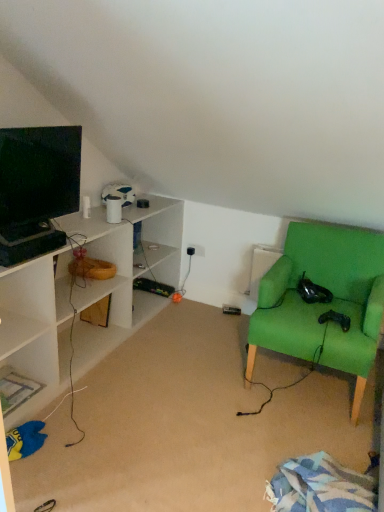
Question: Is there a large distance between matte black monitor at left and black plastic electric outlet at center?

Choices:
 (A) no
 (B) yes

Answer: (B)

Question: From the image's perspective, is matte black monitor at left over black plastic electric outlet at center?

Choices:
 (A) yes
 (B) no

Answer: (A)

Question: Does matte black monitor at left have a greater width compared to black plastic electric outlet at center?

Choices:
 (A) yes
 (B) no

Answer: (A)

Question: Considering the relative positions of matte black monitor at left and black plastic electric outlet at center in the image provided, is matte black monitor at left behind black plastic electric outlet at center?

Choices:
 (A) no
 (B) yes

Answer: (A)

Question: Is matte black monitor at left looking in the opposite direction of black plastic electric outlet at center?

Choices:
 (A) no
 (B) yes

Answer: (A)

Question: Is green fabric chair at right bigger or smaller than matte black monitor at left?

Choices:
 (A) big
 (B) small

Answer: (A)

Question: Looking at their shapes, would you say green fabric chair at right is wider or thinner than matte black monitor at left?

Choices:
 (A) wide
 (B) thin

Answer: (A)

Question: Considering the relative positions of green fabric chair at right and matte black monitor at left in the image provided, is green fabric chair at right to the left or to the right of matte black monitor at left?

Choices:
 (A) left
 (B) right

Answer: (B)

Question: From a real-world perspective, is green fabric chair at right physically located above or below matte black monitor at left?

Choices:
 (A) below
 (B) above

Answer: (A)

Question: From the image's perspective, is matte black monitor at left located above or below green fabric chair at right?

Choices:
 (A) above
 (B) below

Answer: (A)

Question: Considering the positions of matte black monitor at left and green fabric chair at right in the image, is matte black monitor at left bigger or smaller than green fabric chair at right?

Choices:
 (A) big
 (B) small

Answer: (B)

Question: Considering the positions of point (64, 200) and point (89, 376), is point (64, 200) closer or farther from the camera than point (89, 376)?

Choices:
 (A) farther
 (B) closer

Answer: (B)

Question: Relative to green fabric chair at right, is matte black monitor at left in front or behind?

Choices:
 (A) front
 (B) behind

Answer: (B)

Question: Is green fabric chair at right wider or thinner than black plastic electric outlet at center?

Choices:
 (A) thin
 (B) wide

Answer: (B)

Question: Considering the positions of point (206, 373) and point (193, 252), is point (206, 373) closer or farther from the camera than point (193, 252)?

Choices:
 (A) closer
 (B) farther

Answer: (A)